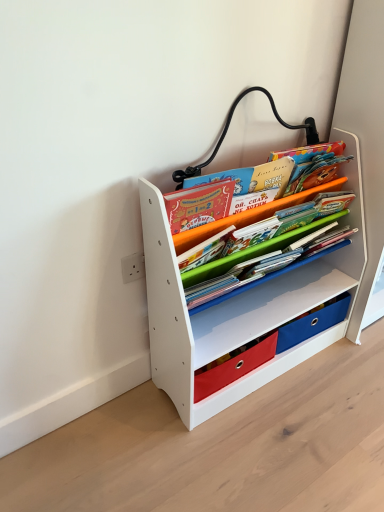
Question: Is white matte bookshelf at center looking in the opposite direction of matte paper book at center?

Choices:
 (A) no
 (B) yes

Answer: (B)

Question: Does white matte bookshelf at center appear on the left side of matte paper book at center?

Choices:
 (A) yes
 (B) no

Answer: (B)

Question: Would you say white matte bookshelf at center is a long distance from matte paper book at center?

Choices:
 (A) yes
 (B) no

Answer: (B)

Question: From the image's perspective, is white matte bookshelf at center over matte paper book at center?

Choices:
 (A) no
 (B) yes

Answer: (A)

Question: Is white matte bookshelf at center oriented towards matte paper book at center?

Choices:
 (A) yes
 (B) no

Answer: (A)

Question: Is white matte bookshelf at center wider than matte paper book at center?

Choices:
 (A) yes
 (B) no

Answer: (A)

Question: Are matte paper book at center and white matte bookshelf at center located far from each other?

Choices:
 (A) no
 (B) yes

Answer: (A)

Question: Considering the relative positions of matte paper book at center and white matte bookshelf at center in the image provided, is matte paper book at center to the right of white matte bookshelf at center from the viewer's perspective?

Choices:
 (A) no
 (B) yes

Answer: (A)

Question: From a real-world perspective, is matte paper book at center located beneath white matte bookshelf at center?

Choices:
 (A) yes
 (B) no

Answer: (B)

Question: From the image's perspective, is matte paper book at center located beneath white matte bookshelf at center?

Choices:
 (A) no
 (B) yes

Answer: (A)

Question: Is matte paper book at center positioned with its back to white matte bookshelf at center?

Choices:
 (A) no
 (B) yes

Answer: (B)

Question: Considering the relative sizes of matte paper book at center and white matte bookshelf at center in the image provided, is matte paper book at center smaller than white matte bookshelf at center?

Choices:
 (A) yes
 (B) no

Answer: (A)

Question: Considering the relative positions of matte paper book at center and white matte bookshelf at center in the image provided, is matte paper book at center to the left or to the right of white matte bookshelf at center?

Choices:
 (A) left
 (B) right

Answer: (A)